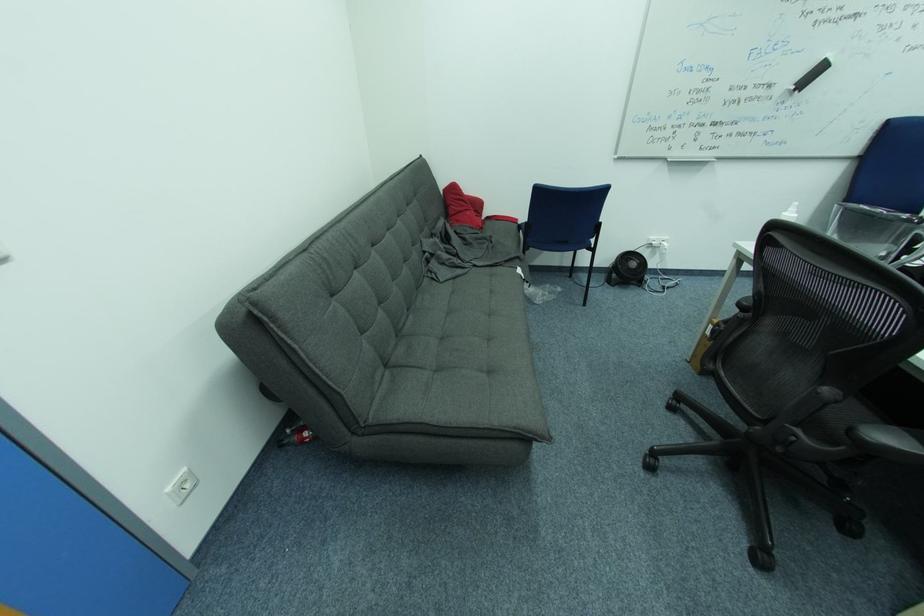
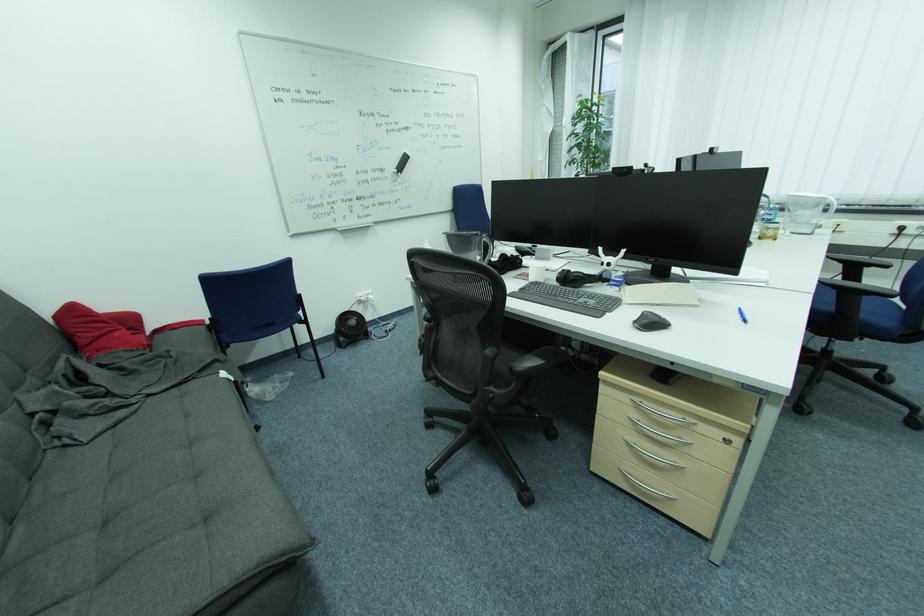
Question: The first image is from the beginning of the video and the second image is from the end. How did the camera likely rotate when shooting the video?

Choices:
 (A) Left
 (B) Right
 (C) Up
 (D) Down

Answer: (B)